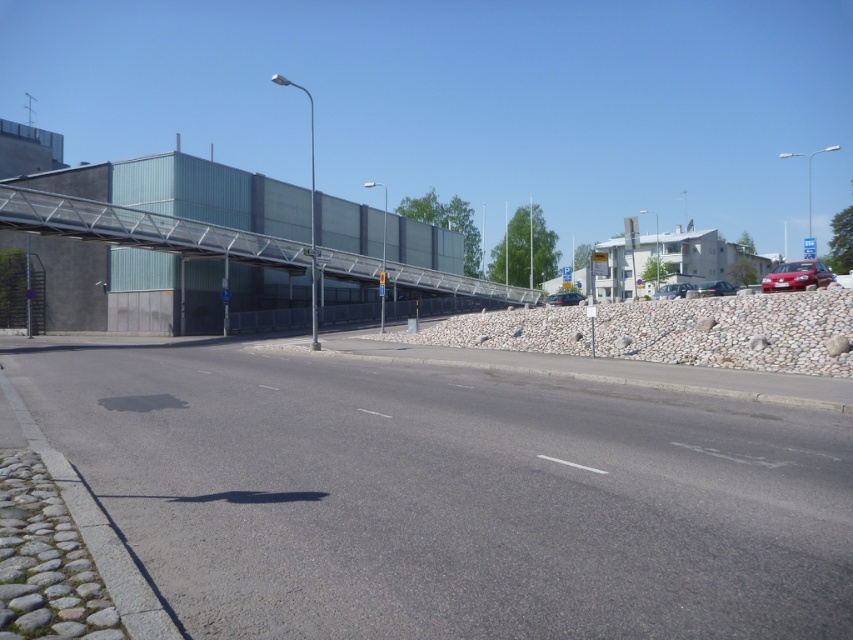
Question: Is metallic gray overpass at center positioned before blue plastic sign at upper right?

Choices:
 (A) no
 (B) yes

Answer: (B)

Question: Which point appears closest to the camera in this image?

Choices:
 (A) (256, 234)
 (B) (811, 256)

Answer: (A)

Question: Can you confirm if metallic gray overpass at center is smaller than blue plastic sign at upper right?

Choices:
 (A) yes
 (B) no

Answer: (A)

Question: From the image, what is the correct spatial relationship of metallic gray overpass at center in relation to blue plastic sign at upper right?

Choices:
 (A) below
 (B) above

Answer: (A)